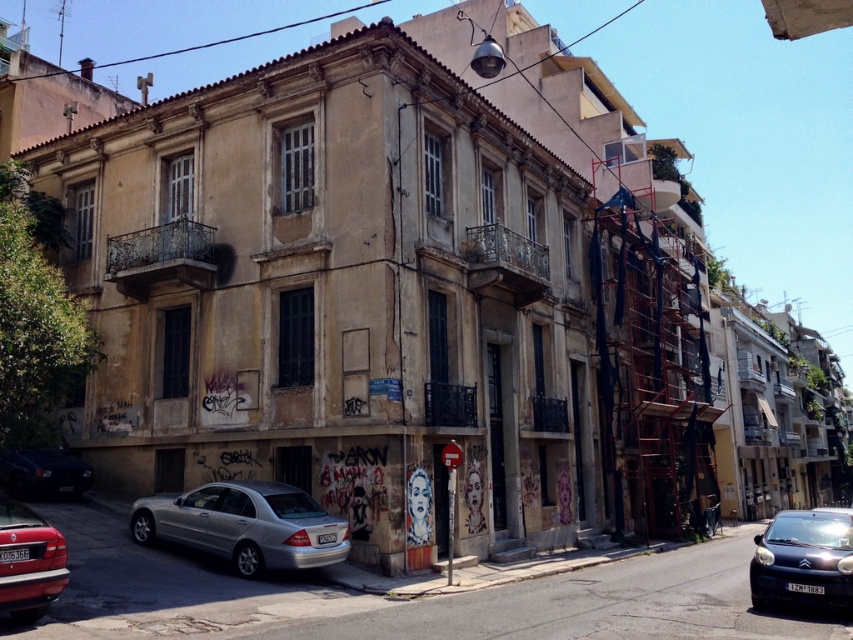
Is the position of shiny red sedan at lower left less distant than that of dark blue matte car at lower left?

Yes, shiny red sedan at lower left is in front of dark blue matte car at lower left.

Between shiny red sedan at lower left and dark blue matte car at lower left, which one appears on the right side from the viewer's perspective?

shiny red sedan at lower left is more to the right.

Is point (19, 595) farther from camera compared to point (53, 476)?

That is False.

This screenshot has width=853, height=640. Find the location of `shiny red sedan at lower left`. shiny red sedan at lower left is located at coordinates (28, 561).

Which is behind, point (776, 515) or point (39, 477)?

Point (776, 515)

Does shiny black car at lower right come behind dark blue matte car at lower left?

No, it is not.

Who is more distant from viewer, (787, 566) or (57, 468)?

The point (57, 468) is more distant.

I want to click on shiny black car at lower right, so click(804, 560).

Can you confirm if silver metallic car at lower center is positioned to the right of dark blue matte car at lower left?

Yes, silver metallic car at lower center is to the right of dark blue matte car at lower left.

Is silver metallic car at lower center below dark blue matte car at lower left?

Yes.

Between point (335, 540) and point (57, 458), which one is positioned in front?

Point (335, 540) is more forward.

Find the location of a particular element. This screenshot has height=640, width=853. silver metallic car at lower center is located at coordinates (245, 525).